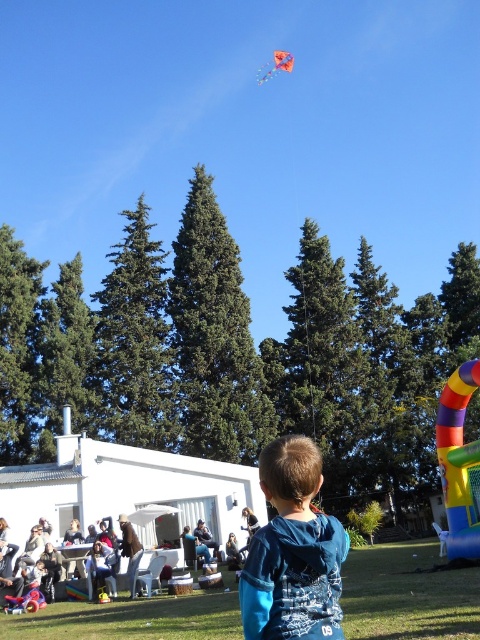
Question: Does blue cotton shirt at lower center appear under dark blue shirt at lower center?

Choices:
 (A) no
 (B) yes

Answer: (A)

Question: Is the position of green grass at lower center more distant than that of green matte pine at center?

Choices:
 (A) no
 (B) yes

Answer: (A)

Question: Considering the real-world distances, which object is farthest from the blue cotton shirt at lower center?

Choices:
 (A) multicolored fabric kite at upper center
 (B) green matte pine at center

Answer: (A)

Question: Is green textured pine at center below multicolored fabric kite at upper center?

Choices:
 (A) yes
 (B) no

Answer: (A)

Question: Estimate the real-world distances between objects in this image. Which object is farther from the green grass at lower center?

Choices:
 (A) green textured pine at center
 (B) green matte pine at center
 (C) blue cotton shirt at lower center
 (D) dark blue shirt at lower center

Answer: (B)

Question: Which object appears closest to the camera in this image?

Choices:
 (A) dark blue shirt at lower center
 (B) green grass at lower center
 (C) blue cotton shirt at lower center

Answer: (C)